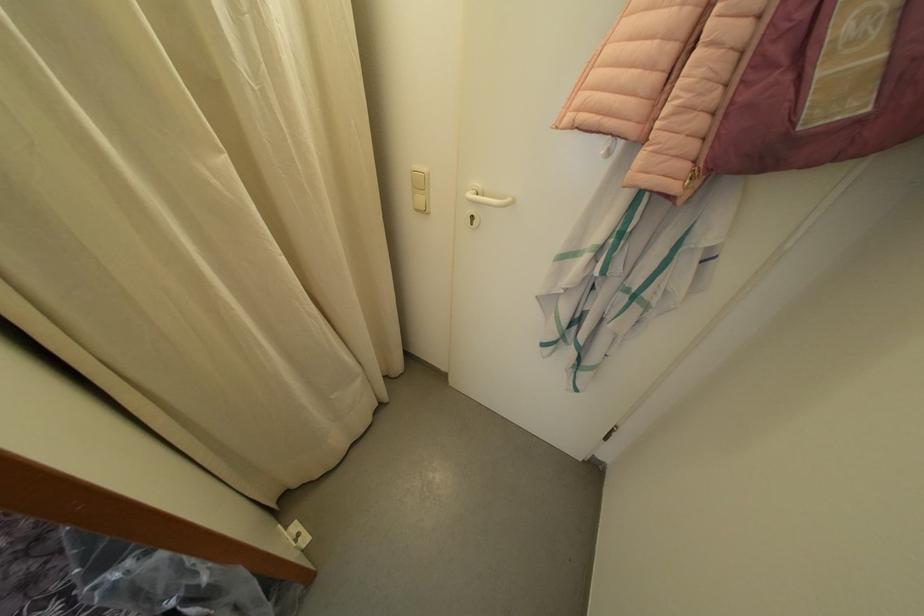
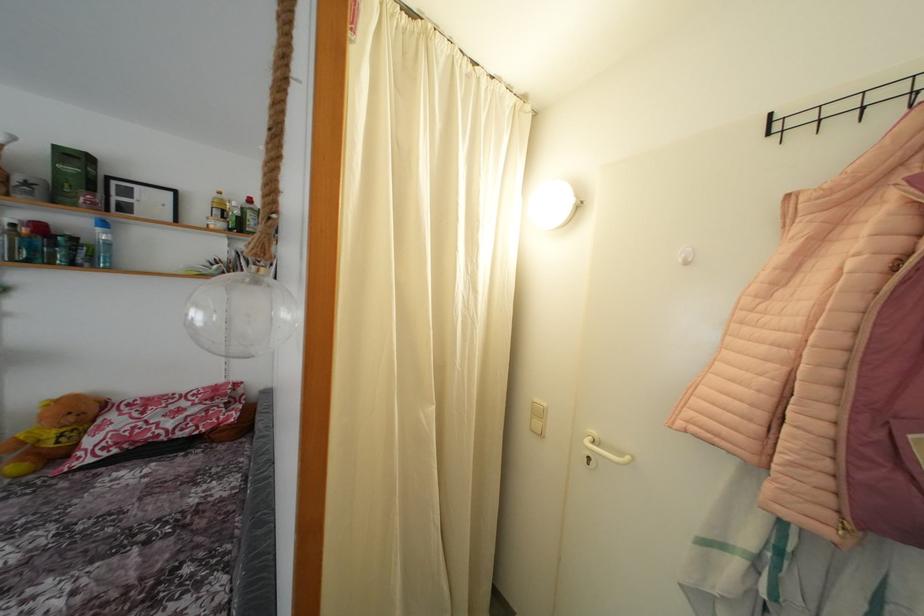
First-person continuous shooting, in which direction is the camera rotating?

The rotation direction of the camera is left-up.